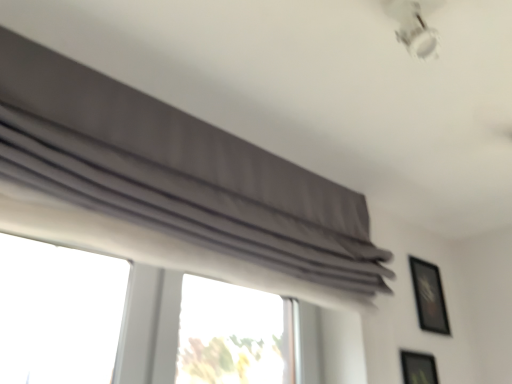
Identify the location of white glossy lamp at upper right. (414, 25).

The height and width of the screenshot is (384, 512). What do you see at coordinates (418, 368) in the screenshot? I see `matte black picture frame at lower right, acting as the 1th picture frame starting from the bottom` at bounding box center [418, 368].

This screenshot has height=384, width=512. I want to click on black glossy picture frame at upper right, acting as the 1th picture frame starting from the back, so click(x=429, y=296).

The image size is (512, 384). Identify the location of white glossy lamp at upper right. (414, 25).

Considering the sizes of objects black glossy picture frame at upper right, which ranks as the 2th picture frame in front-to-back order, and matte black picture frame at lower right, the 2th picture frame when ordered from top to bottom, in the image provided, who is thinner, black glossy picture frame at upper right, which ranks as the 2th picture frame in front-to-back order, or matte black picture frame at lower right, the 2th picture frame when ordered from top to bottom,?

Thinner between the two is matte black picture frame at lower right, the 2th picture frame when ordered from top to bottom.

From a real-world perspective, which is physically below, black glossy picture frame at upper right, acting as the 1th picture frame starting from the top, or matte black picture frame at lower right, which is counted as the 1th picture frame, starting from the front?

In real-world perspective, matte black picture frame at lower right, which is counted as the 1th picture frame, starting from the front, is lower.

Is black glossy picture frame at upper right, acting as the 1th picture frame starting from the top, far away from matte black picture frame at lower right, acting as the 1th picture frame starting from the bottom?

That's not correct — black glossy picture frame at upper right, acting as the 1th picture frame starting from the top, is a little close to matte black picture frame at lower right, acting as the 1th picture frame starting from the bottom.

From the picture: Is black glossy picture frame at upper right, which appears as the second picture frame when ordered from the bottom, looking in the opposite direction of matte black picture frame at lower right, which is counted as the 1th picture frame, starting from the front?

black glossy picture frame at upper right, which appears as the second picture frame when ordered from the bottom, is not turned away from matte black picture frame at lower right, which is counted as the 1th picture frame, starting from the front.

Which of these two, black glossy picture frame at upper right, acting as the 1th picture frame starting from the back, or white glossy lamp at upper right, is bigger?

With larger size is black glossy picture frame at upper right, acting as the 1th picture frame starting from the back.

Is black glossy picture frame at upper right, which appears as the second picture frame when ordered from the bottom, further to camera compared to white glossy lamp at upper right?

Yes, the depth of black glossy picture frame at upper right, which appears as the second picture frame when ordered from the bottom, is greater than that of white glossy lamp at upper right.

Between black glossy picture frame at upper right, acting as the 1th picture frame starting from the back, and white glossy lamp at upper right, which one has smaller width?

With smaller width is black glossy picture frame at upper right, acting as the 1th picture frame starting from the back.

Measure the distance from black glossy picture frame at upper right, which appears as the second picture frame when ordered from the bottom, to white glossy lamp at upper right.

A distance of 1.32 meters exists between black glossy picture frame at upper right, which appears as the second picture frame when ordered from the bottom, and white glossy lamp at upper right.

Who is shorter, white glossy lamp at upper right or black glossy picture frame at upper right, which appears as the second picture frame when ordered from the bottom?

white glossy lamp at upper right is shorter.

Which is more to the left, white glossy lamp at upper right or black glossy picture frame at upper right, which ranks as the 2th picture frame in front-to-back order?

white glossy lamp at upper right is more to the left.

Looking at this image, are white glossy lamp at upper right and black glossy picture frame at upper right, which appears as the second picture frame when ordered from the bottom, far apart?

white glossy lamp at upper right is positioned a significant distance from black glossy picture frame at upper right, which appears as the second picture frame when ordered from the bottom.

Is white glossy lamp at upper right closer to camera compared to black glossy picture frame at upper right, which ranks as the 2th picture frame in front-to-back order?

That is True.

Is gray fabric curtain at upper center inside or outside of matte black picture frame at lower right, the 2th picture frame when ordered from top to bottom?

gray fabric curtain at upper center is outside matte black picture frame at lower right, the 2th picture frame when ordered from top to bottom.

Which object is positioned more to the left, gray fabric curtain at upper center or matte black picture frame at lower right, arranged as the second picture frame when viewed from the back?

gray fabric curtain at upper center is more to the left.

Between gray fabric curtain at upper center and matte black picture frame at lower right, arranged as the second picture frame when viewed from the back, which one has smaller width?

matte black picture frame at lower right, arranged as the second picture frame when viewed from the back, is thinner.

Considering the sizes of objects gray fabric curtain at upper center and matte black picture frame at lower right, arranged as the second picture frame when viewed from the back, in the image provided, who is smaller, gray fabric curtain at upper center or matte black picture frame at lower right, arranged as the second picture frame when viewed from the back,?

matte black picture frame at lower right, arranged as the second picture frame when viewed from the back, is smaller.

Who is shorter, matte black picture frame at lower right, the 2th picture frame when ordered from top to bottom, or black glossy picture frame at upper right, acting as the 1th picture frame starting from the top?

Standing shorter between the two is black glossy picture frame at upper right, acting as the 1th picture frame starting from the top.

Between matte black picture frame at lower right, the 2th picture frame when ordered from top to bottom, and black glossy picture frame at upper right, acting as the 1th picture frame starting from the top, which one has larger size?

Bigger between the two is black glossy picture frame at upper right, acting as the 1th picture frame starting from the top.

Is matte black picture frame at lower right, the 2th picture frame when ordered from top to bottom, not near black glossy picture frame at upper right, which ranks as the 2th picture frame in front-to-back order?

No, there isn't a large distance between matte black picture frame at lower right, the 2th picture frame when ordered from top to bottom, and black glossy picture frame at upper right, which ranks as the 2th picture frame in front-to-back order.

From the image's perspective, is black glossy picture frame at upper right, acting as the 1th picture frame starting from the back, above or below gray fabric curtain at upper center?

black glossy picture frame at upper right, acting as the 1th picture frame starting from the back, is situated lower than gray fabric curtain at upper center in the image.

Can you confirm if black glossy picture frame at upper right, which ranks as the 2th picture frame in front-to-back order, is shorter than gray fabric curtain at upper center?

Yes.

Is black glossy picture frame at upper right, acting as the 1th picture frame starting from the top, bigger than gray fabric curtain at upper center?

No, black glossy picture frame at upper right, acting as the 1th picture frame starting from the top, is not bigger than gray fabric curtain at upper center.

Is gray fabric curtain at upper center taller or shorter than white glossy lamp at upper right?

gray fabric curtain at upper center is taller than white glossy lamp at upper right.

In the image, is gray fabric curtain at upper center positioned in front of or behind white glossy lamp at upper right?

Clearly, gray fabric curtain at upper center is in front of white glossy lamp at upper right.

From the image's perspective, is gray fabric curtain at upper center positioned above or below white glossy lamp at upper right?

From the image's perspective, gray fabric curtain at upper center appears below white glossy lamp at upper right.

Locate an element on the screen. The image size is (512, 384). picture frame to the left of black glossy picture frame at upper right, which ranks as the 2th picture frame in front-to-back order is located at coordinates (418, 368).

Where is `the 2nd picture frame behind the white glossy lamp at upper right, starting your count from the anchor`? This screenshot has height=384, width=512. the 2nd picture frame behind the white glossy lamp at upper right, starting your count from the anchor is located at coordinates (429, 296).

When comparing their distances from matte black picture frame at lower right, which is counted as the 1th picture frame, starting from the front, does gray fabric curtain at upper center or black glossy picture frame at upper right, acting as the 1th picture frame starting from the back, seem further?

Based on the image, gray fabric curtain at upper center appears to be further to matte black picture frame at lower right, which is counted as the 1th picture frame, starting from the front.

Based on their spatial positions, is black glossy picture frame at upper right, which appears as the second picture frame when ordered from the bottom, or white glossy lamp at upper right further from gray fabric curtain at upper center?

The object further to gray fabric curtain at upper center is black glossy picture frame at upper right, which appears as the second picture frame when ordered from the bottom.

From the image, which object appears to be farther from black glossy picture frame at upper right, which appears as the second picture frame when ordered from the bottom, gray fabric curtain at upper center or white glossy lamp at upper right?

Based on the image, white glossy lamp at upper right appears to be further to black glossy picture frame at upper right, which appears as the second picture frame when ordered from the bottom.

Based on their spatial positions, is white glossy lamp at upper right or matte black picture frame at lower right, arranged as the second picture frame when viewed from the back, closer to gray fabric curtain at upper center?

The object closer to gray fabric curtain at upper center is white glossy lamp at upper right.

Looking at the image, which one is located further to matte black picture frame at lower right, acting as the 1th picture frame starting from the bottom, black glossy picture frame at upper right, acting as the 1th picture frame starting from the back, or gray fabric curtain at upper center?

Among the two, gray fabric curtain at upper center is located further to matte black picture frame at lower right, acting as the 1th picture frame starting from the bottom.

Looking at the image, which one is located further to white glossy lamp at upper right, black glossy picture frame at upper right, acting as the 1th picture frame starting from the top, or matte black picture frame at lower right, which is counted as the 1th picture frame, starting from the front?

black glossy picture frame at upper right, acting as the 1th picture frame starting from the top, is positioned further to the anchor white glossy lamp at upper right.

When comparing their distances from gray fabric curtain at upper center, does matte black picture frame at lower right, acting as the 1th picture frame starting from the bottom, or white glossy lamp at upper right seem closer?

The object closer to gray fabric curtain at upper center is white glossy lamp at upper right.

Looking at the image, which one is located closer to gray fabric curtain at upper center, white glossy lamp at upper right or black glossy picture frame at upper right, which appears as the second picture frame when ordered from the bottom?

white glossy lamp at upper right is positioned closer to the anchor gray fabric curtain at upper center.

Find the location of `picture frame between white glossy lamp at upper right and matte black picture frame at lower right, which is counted as the 1th picture frame, starting from the front, in the up-down direction`. picture frame between white glossy lamp at upper right and matte black picture frame at lower right, which is counted as the 1th picture frame, starting from the front, in the up-down direction is located at coordinates 429,296.

You are a GUI agent. You are given a task and a screenshot of the screen. Output one action in this format:
    pyautogui.click(x=<x>, y=<y>)
    Task: Click on the curtain that lies between white glossy lamp at upper right and matte black picture frame at lower right, the 2th picture frame when ordered from top to bottom, from top to bottom
    This screenshot has height=384, width=512.
    Given the screenshot: What is the action you would take?
    pyautogui.click(x=176, y=172)

Where is `picture frame located between gray fabric curtain at upper center and black glossy picture frame at upper right, which ranks as the 2th picture frame in front-to-back order, in the depth direction`? This screenshot has width=512, height=384. picture frame located between gray fabric curtain at upper center and black glossy picture frame at upper right, which ranks as the 2th picture frame in front-to-back order, in the depth direction is located at coordinates (418, 368).

This screenshot has width=512, height=384. I want to click on lamp positioned between gray fabric curtain at upper center and black glossy picture frame at upper right, which appears as the second picture frame when ordered from the bottom, from near to far, so click(414, 25).